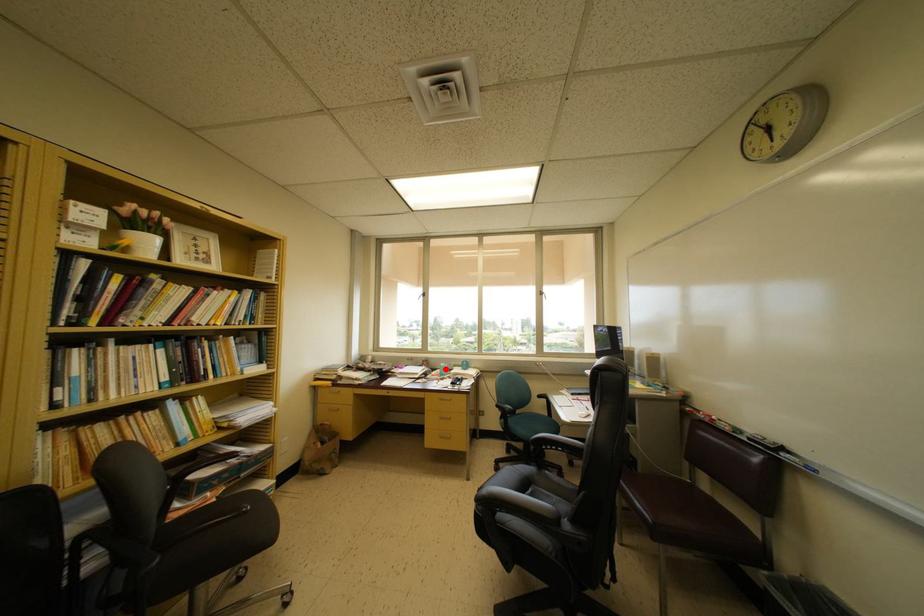
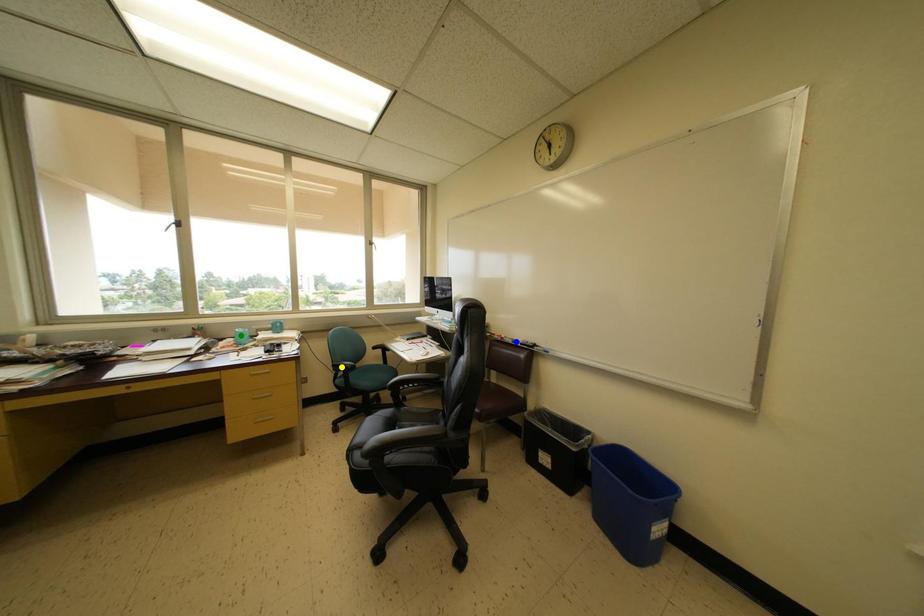
Question: I am providing you with two images of the same scene from different viewpoints. A red point is marked on the first image. You are given multiple points on the second image. Can you choose the point in image 2 that corresponds to the point in image 1?

Choices:
 (A) yellow point
 (B) blue point
 (C) green point

Answer: (C)